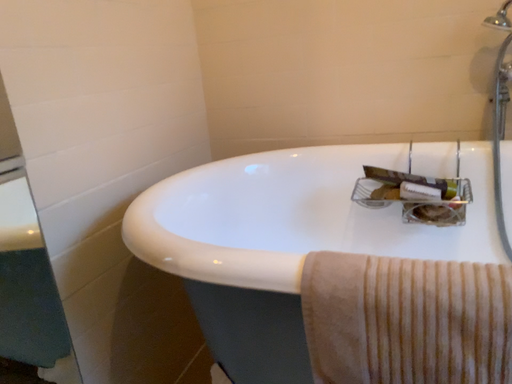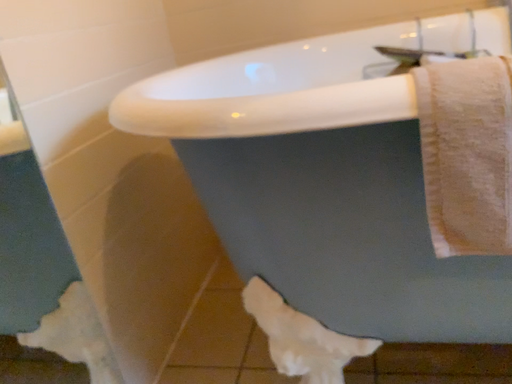
Question: Which way did the camera rotate in the video?

Choices:
 (A) rotated right
 (B) rotated left

Answer: (A)